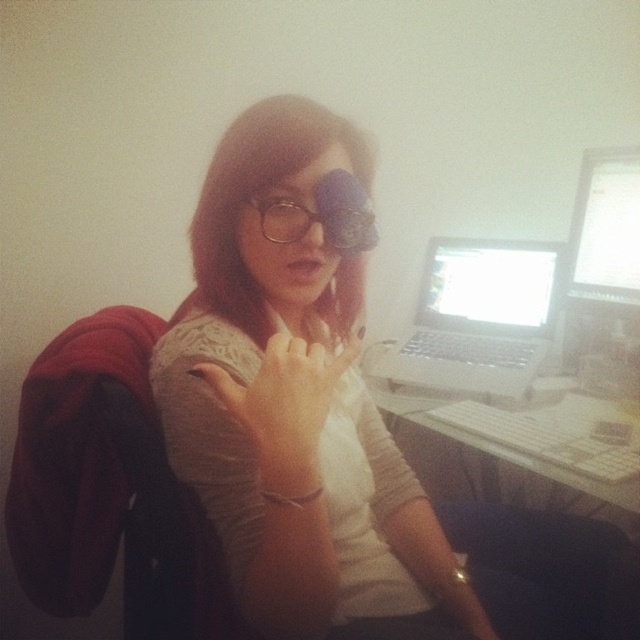
Question: Which object is the closest to the matte silver laptop at upper right?

Choices:
 (A) white plastic keyboard at center
 (B) matte black glasses at center
 (C) white glossy laptop at upper right
 (D) metallic frame glasses at center

Answer: (C)

Question: Which point is closer to the camera?

Choices:
 (A) matte silver laptop at upper right
 (B) metallic frame glasses at center

Answer: (B)

Question: Based on their relative distances, which object is farther from the matte black glasses at center?

Choices:
 (A) silver metallic laptop at center
 (B) matte silver laptop at upper right

Answer: (B)

Question: Can you confirm if matte black glasses at center is smaller than white glossy laptop at upper right?

Choices:
 (A) no
 (B) yes

Answer: (A)

Question: Is matte black glasses at center to the right of metallic frame glasses at center from the viewer's perspective?

Choices:
 (A) no
 (B) yes

Answer: (B)

Question: From the image, what is the correct spatial relationship of white glossy laptop at upper right in relation to metallic frame glasses at center?

Choices:
 (A) left
 (B) right

Answer: (B)